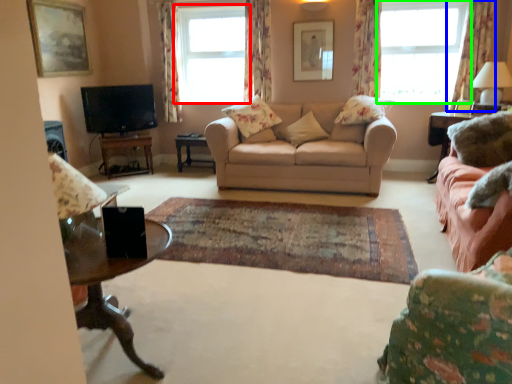
Question: Which object is the closest to the window (highlighted by a red box)? Choose among these: curtain (highlighted by a blue box) or window (highlighted by a green box).

Choices:
 (A) curtain
 (B) window

Answer: (B)